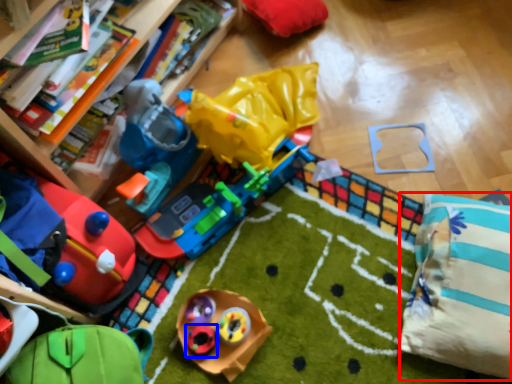
Question: Which object is closer to the camera taking this photo, pillow (highlighted by a red box) or toy (highlighted by a blue box)?

Choices:
 (A) pillow
 (B) toy

Answer: (A)